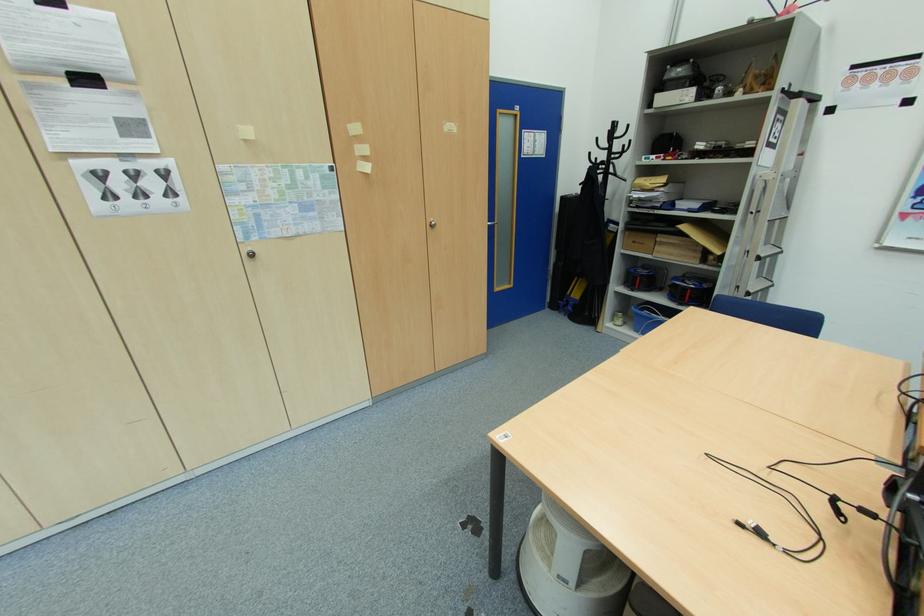
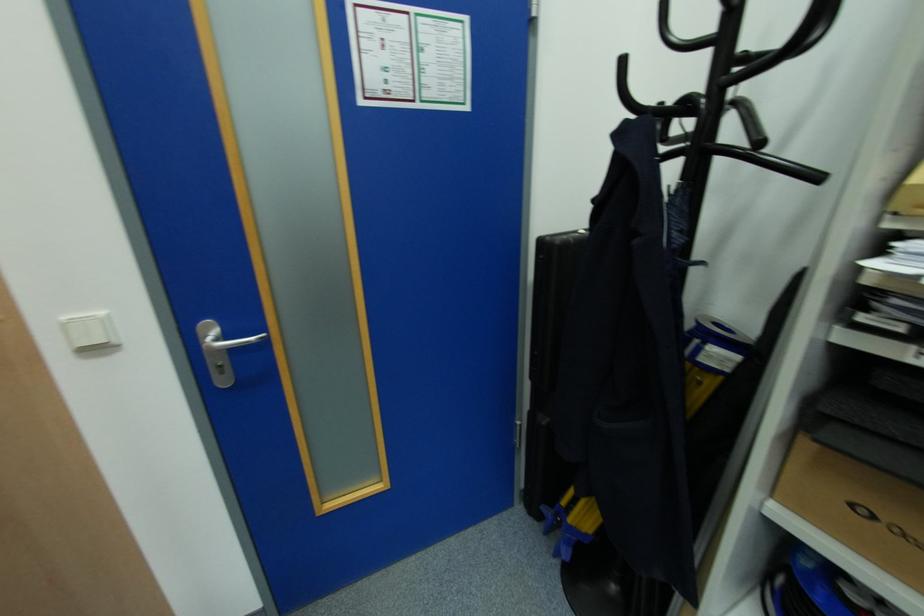
Which direction would the cameraman need to move to produce the second image?

The cameraman walked toward right, forward.